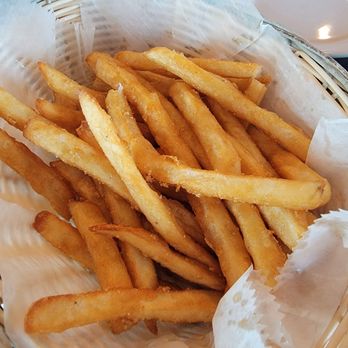
Where is `grease spot`? grease spot is located at coordinates (236, 297).